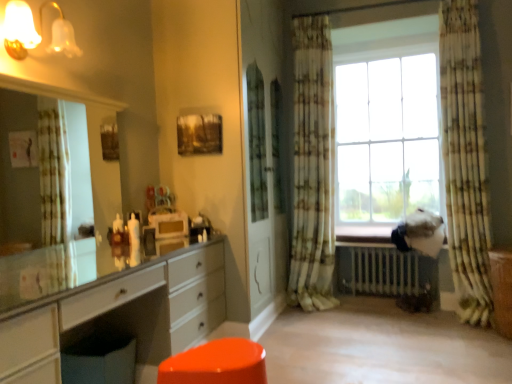
Locate an element on the screen. The height and width of the screenshot is (384, 512). blank space above glossy plastic stool at lower center (from a real-world perspective) is located at coordinates (216, 357).